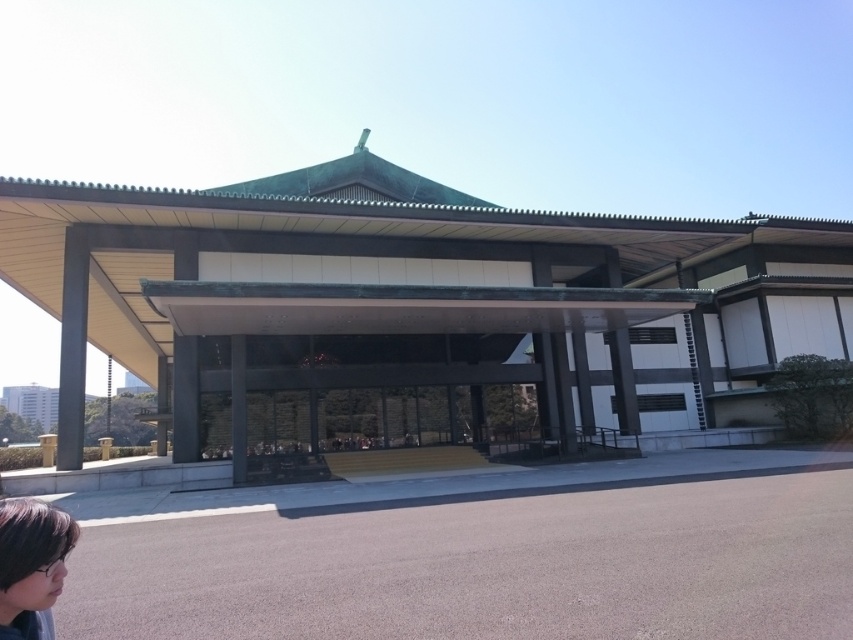
Question: Is green matte building at center closer to the viewer compared to dark brown hair at lower left?

Choices:
 (A) yes
 (B) no

Answer: (B)

Question: From the image, what is the correct spatial relationship of green matte building at center in relation to dark brown hair at lower left?

Choices:
 (A) right
 (B) left

Answer: (B)

Question: Is green matte building at center further to the viewer compared to dark brown hair at lower left?

Choices:
 (A) yes
 (B) no

Answer: (A)

Question: Which point is closer to the camera?

Choices:
 (A) green matte building at center
 (B) dark brown hair at lower left

Answer: (B)